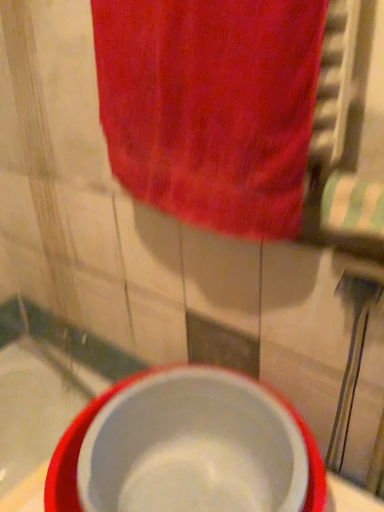
Question: From their relative heights in the image, would you say red cotton towel at upper center is taller or shorter than white glossy bath at lower left?

Choices:
 (A) short
 (B) tall

Answer: (B)

Question: In terms of size, does red cotton towel at upper center appear bigger or smaller than white glossy bath at lower left?

Choices:
 (A) small
 (B) big

Answer: (A)

Question: Considering the real-world distances, which object is farthest from the red cotton towel at upper center?

Choices:
 (A) white glossy bath at lower left
 (B) white plastic basin at center

Answer: (A)

Question: Estimate the real-world distances between objects in this image. Which object is closer to the white glossy bath at lower left?

Choices:
 (A) white plastic basin at center
 (B) red cotton towel at upper center

Answer: (A)